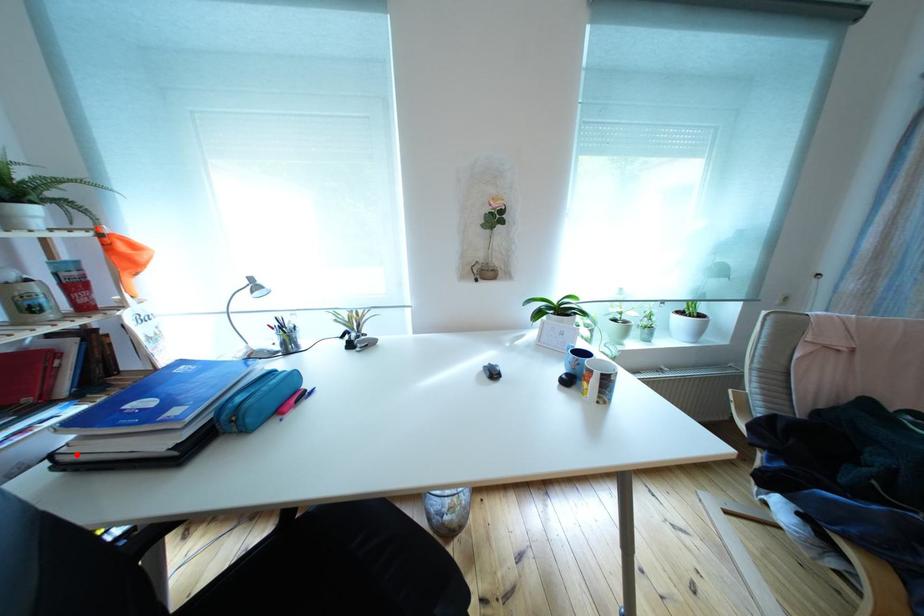
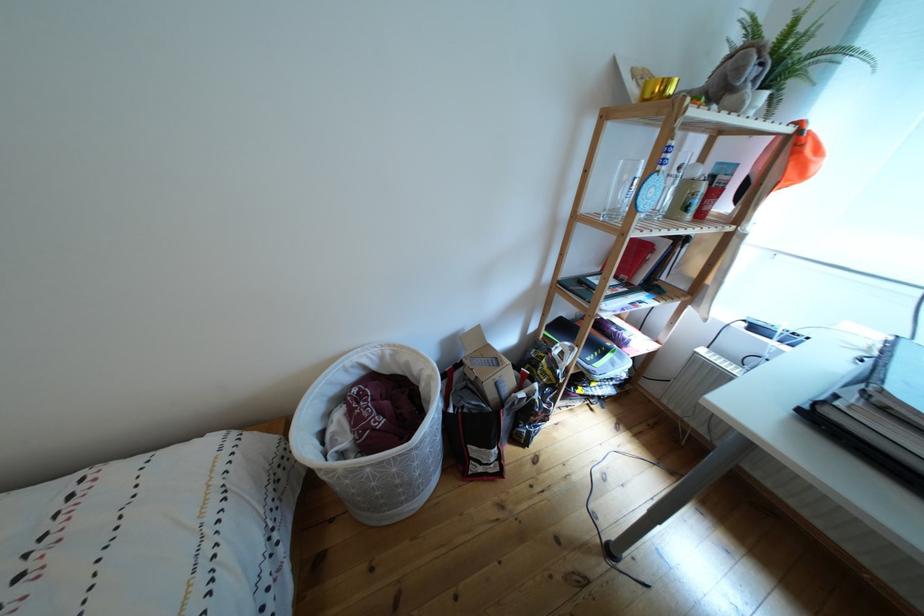
Question: I am providing you with two images of the same scene from different viewpoints. Given a red point in image1, look at the same physical point in image2. Is it:

Choices:
 (A) Closer to the viewpoint
 (B) Farther from the viewpoint

Answer: (B)